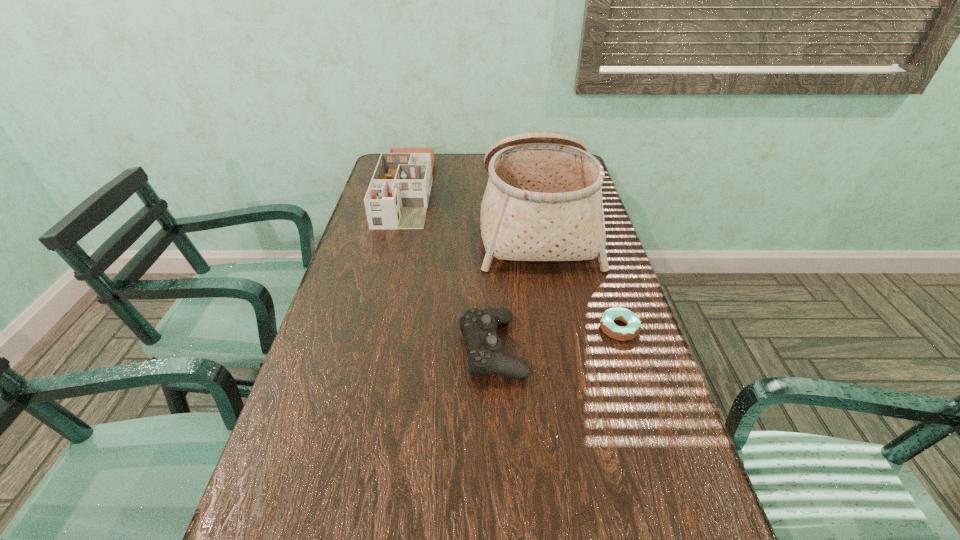
Image resolution: width=960 pixels, height=540 pixels. I want to click on free space between the basket and the leftmost object, so click(471, 207).

This screenshot has width=960, height=540. In order to click on free spot between the third shortest object and the second shortest object in this screenshot , I will do `click(449, 269)`.

Locate an element on the screen. The height and width of the screenshot is (540, 960). free space between the leftmost object and the basket is located at coordinates (471, 207).

Image resolution: width=960 pixels, height=540 pixels. Identify the location of free spot between the second shortest object and the leftmost object. (449, 269).

I want to click on free point between the dollhouse and the basket, so click(471, 207).

The width and height of the screenshot is (960, 540). I want to click on blank region between the basket and the control, so click(x=515, y=286).

The height and width of the screenshot is (540, 960). I want to click on free space between the doughnut and the third tallest object, so click(x=556, y=338).

Where is `object that stands as the third closest to the second shortest object`? The width and height of the screenshot is (960, 540). object that stands as the third closest to the second shortest object is located at coordinates (398, 195).

Point out which object is positioned as the nearest to the shortest object. Please provide its 2D coordinates. Your answer should be formatted as a tuple, i.e. [(x, y)], where the tuple contains the x and y coordinates of a point satisfying the conditions above.

[(543, 201)]

Where is `blank area in the image that satisfies the following two spatial constraints: 1. with the lid open on the doughnut; 2. on the right side of the tallest object`? The height and width of the screenshot is (540, 960). blank area in the image that satisfies the following two spatial constraints: 1. with the lid open on the doughnut; 2. on the right side of the tallest object is located at coordinates tap(555, 328).